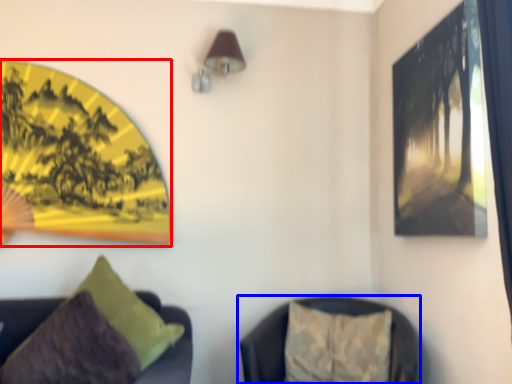
Question: Among these objects, which one is farthest to the camera, picture frame (highlighted by a red box) or furniture (highlighted by a blue box)?

Choices:
 (A) picture frame
 (B) furniture

Answer: (A)